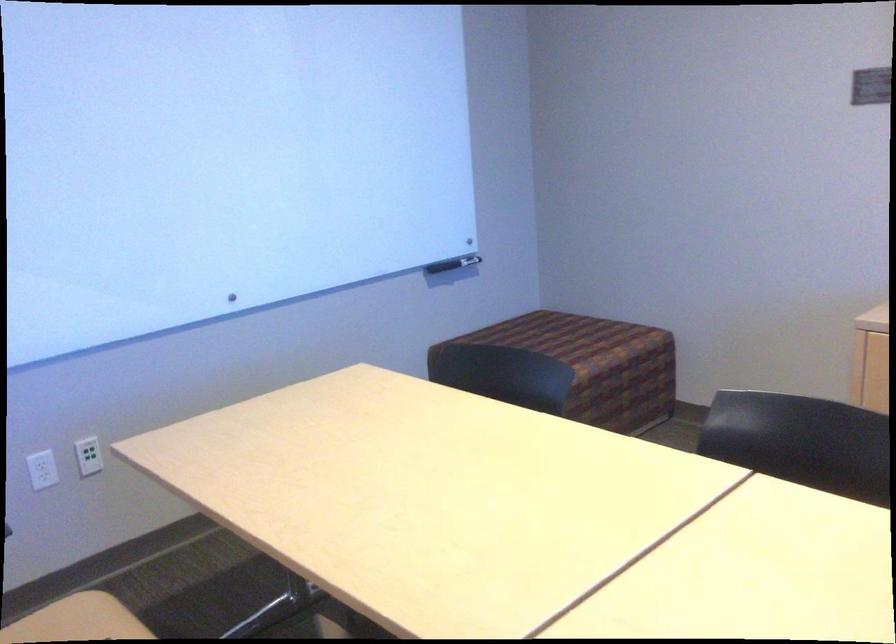
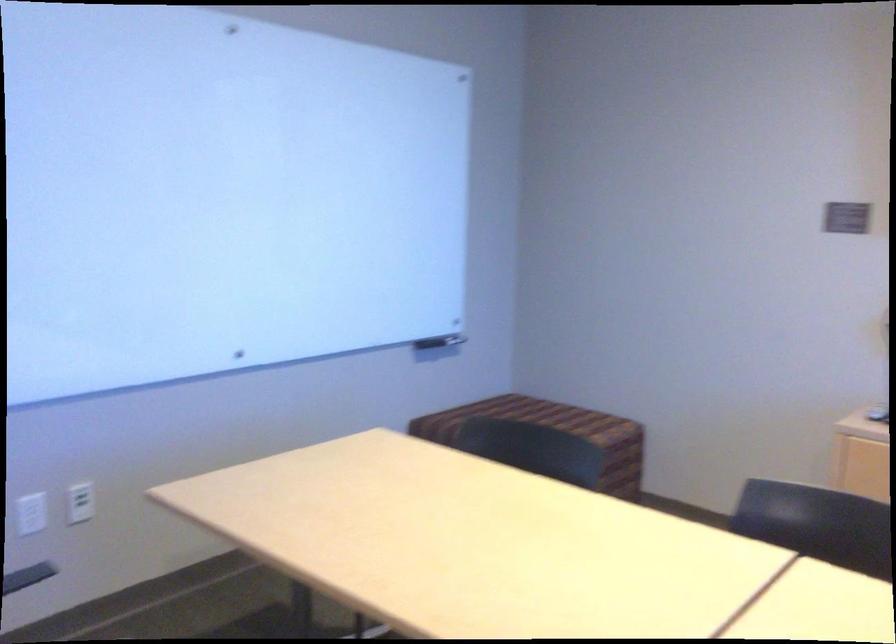
Locate, in the second image, the point that corresponds to pixel 91 453 in the first image.

(80, 502)